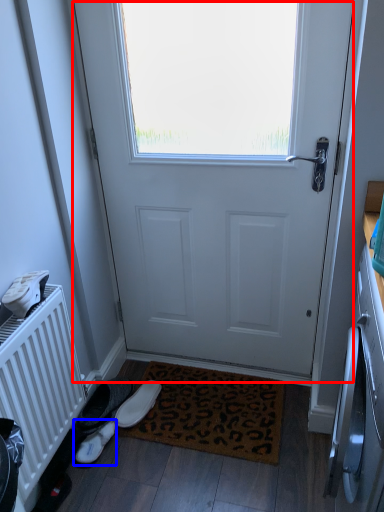
Question: Which point is further to the camera, door (highlighted by a red box) or footwear (highlighted by a blue box)?

Choices:
 (A) door
 (B) footwear

Answer: (B)